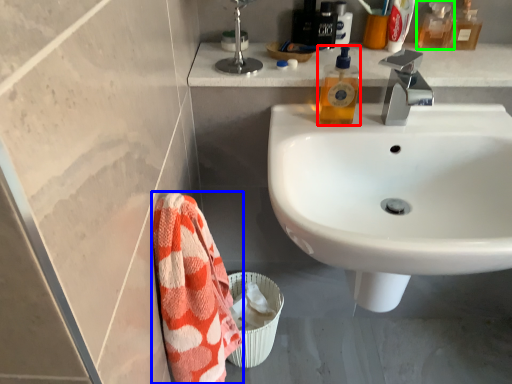
Question: Based on their relative distances, which object is nearer to toiletry (highlighted by a red box)? Choose from beach towel (highlighted by a blue box) and mouthwash (highlighted by a green box).

Choices:
 (A) beach towel
 (B) mouthwash

Answer: (B)